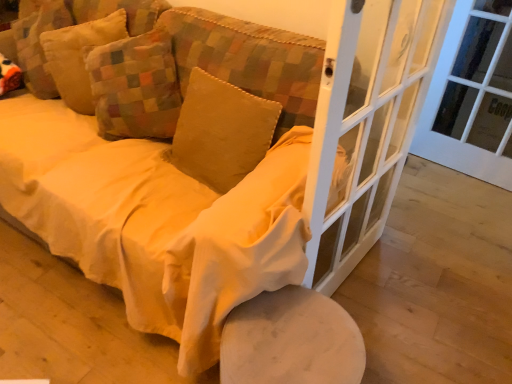
What do you see at coordinates (185, 230) in the screenshot? The image size is (512, 384). I see `velvet yellow couch at center` at bounding box center [185, 230].

What is the approximate height of velvet yellow couch at center?

91.75 centimeters.

The height and width of the screenshot is (384, 512). I want to click on white glass screen door at center right, so click(367, 122).

Identify the location of velvet yellow pillow at upper left, the 3th pillow in the right-to-left sequence. The height and width of the screenshot is (384, 512). (79, 56).

Based on their sizes in the image, would you say white glass screen door at center right is bigger or smaller than velvet yellow pillow at upper left, which ranks as the second pillow in right-to-left order?

Clearly, white glass screen door at center right is larger in size than velvet yellow pillow at upper left, which ranks as the second pillow in right-to-left order.

Does white glass screen door at center right appear on the left side of velvet yellow pillow at upper left, acting as the second pillow starting from the left?

In fact, white glass screen door at center right is to the right of velvet yellow pillow at upper left, acting as the second pillow starting from the left.

From a real-world perspective, between white glass screen door at center right and velvet yellow pillow at upper left, which ranks as the second pillow in right-to-left order, who is vertically lower?

white glass screen door at center right, from a real-world perspective.

Locate an element on the screen. screen door in front of the velvet yellow pillow at upper left, acting as the second pillow starting from the left is located at coordinates tap(367, 122).

Is velvet yellow couch at center beside velvet yellow pillow at upper left, the 1th pillow from the left?

velvet yellow couch at center is not next to velvet yellow pillow at upper left, the 1th pillow from the left, and they're not touching.

Based on the photo, from a real-world perspective, between velvet yellow couch at center and velvet yellow pillow at upper left, the 3th pillow in the right-to-left sequence, who is vertically lower?

velvet yellow couch at center is physically lower.

Does velvet yellow couch at center have a larger size compared to velvet yellow pillow at upper left, the 1th pillow from the left?

Indeed, velvet yellow couch at center has a larger size compared to velvet yellow pillow at upper left, the 1th pillow from the left.

Does velvet yellow couch at center have a lesser width compared to velvet yellow pillow at upper left, the 1th pillow from the left?

No.

Is point (313, 156) less distant than point (96, 30)?

Yes, it is.

From the image's perspective, is white glass screen door at center right under velvet yellow pillow at upper left, the 1th pillow from the left?

Correct, white glass screen door at center right appears lower than velvet yellow pillow at upper left, the 1th pillow from the left, in the image.

Which object is more forward, white glass screen door at center right or velvet yellow pillow at upper left, the 1th pillow from the left?

white glass screen door at center right is more forward.

From a real-world perspective, between white glass screen door at center right and velvet yellow pillow at upper left, the 3th pillow in the right-to-left sequence, who is vertically lower?

In real-world perspective, white glass screen door at center right is lower.

From the image's perspective, is velvet yellow pillow at upper left, the 1th pillow from the left, above white marble stool at lower center?

→ Correct, velvet yellow pillow at upper left, the 1th pillow from the left, appears higher than white marble stool at lower center in the image.

Considering the sizes of objects velvet yellow pillow at upper left, the 3th pillow in the right-to-left sequence, and white marble stool at lower center in the image provided, who is wider, velvet yellow pillow at upper left, the 3th pillow in the right-to-left sequence, or white marble stool at lower center?

white marble stool at lower center.

Based on their positions, is velvet yellow pillow at upper left, the 1th pillow from the left, located to the left or right of white marble stool at lower center?

velvet yellow pillow at upper left, the 1th pillow from the left, is positioned on white marble stool at lower center's left side.

Could you tell me if velvet yellow pillow at upper left, the 1th pillow from the left, is facing white marble stool at lower center?

No, velvet yellow pillow at upper left, the 1th pillow from the left, does not turn towards white marble stool at lower center.

I want to click on studio couch in front of the velvet yellow pillow at center, acting as the third pillow starting from the left, so click(x=185, y=230).

Does velvet yellow pillow at center, which is the first pillow in right-to-left order, come in front of velvet yellow couch at center?

No, it is not.

Choose the correct answer: Is velvet yellow pillow at center, which is the first pillow in right-to-left order, inside velvet yellow couch at center or outside it?

The correct answer is: inside.

What's the angular difference between velvet yellow pillow at center, acting as the third pillow starting from the left, and velvet yellow couch at center's facing directions?

There is a 0.000449-degree angle between the facing directions of velvet yellow pillow at center, acting as the third pillow starting from the left, and velvet yellow couch at center.

Which is behind, point (231, 331) or point (369, 83)?

The point (369, 83) is farther from the camera.

Is white marble stool at lower center positioned in front of white glass screen door at center right?

No, white marble stool at lower center is behind white glass screen door at center right.

From a real-world perspective, between white marble stool at lower center and white glass screen door at center right, who is vertically higher?

white glass screen door at center right.

From the image's perspective, is white glass screen door at center right below velvet yellow pillow at center, acting as the third pillow starting from the left?

Yes.

Is white glass screen door at center right looking in the opposite direction of velvet yellow pillow at center, which is the first pillow in right-to-left order?

Yes.

Which of these two, white glass screen door at center right or velvet yellow pillow at center, which is the first pillow in right-to-left order, stands shorter?

velvet yellow pillow at center, which is the first pillow in right-to-left order.

Based on the photo, between white glass screen door at center right and velvet yellow pillow at center, which is the first pillow in right-to-left order, which one has smaller width?

With smaller width is white glass screen door at center right.

The image size is (512, 384). There is a white glass screen door at center right. Find the location of `the 2nd pillow above it (from the image's perspective)`. the 2nd pillow above it (from the image's perspective) is located at coordinates [x=135, y=87].

Where is `studio couch that is in front of the velvet yellow pillow at upper left, the 1th pillow from the left`? studio couch that is in front of the velvet yellow pillow at upper left, the 1th pillow from the left is located at coordinates (185, 230).

Which object lies further to the anchor point white glass door at right, velvet yellow pillow at upper left, the 3th pillow in the right-to-left sequence, or velvet yellow couch at center?

Based on the image, velvet yellow pillow at upper left, the 3th pillow in the right-to-left sequence, appears to be further to white glass door at right.

When comparing their distances from velvet yellow pillow at upper left, the 3th pillow in the right-to-left sequence, does velvet yellow pillow at upper left, acting as the second pillow starting from the left, or white marble stool at lower center seem further?

white marble stool at lower center lies further to velvet yellow pillow at upper left, the 3th pillow in the right-to-left sequence, than the other object.

Based on their spatial positions, is velvet yellow couch at center or velvet yellow pillow at center, acting as the third pillow starting from the left, closer to velvet yellow pillow at upper left, acting as the second pillow starting from the left?

Based on the image, velvet yellow pillow at center, acting as the third pillow starting from the left, appears to be nearer to velvet yellow pillow at upper left, acting as the second pillow starting from the left.

When comparing their distances from velvet yellow pillow at center, which is the first pillow in right-to-left order, does velvet yellow pillow at upper left, which ranks as the second pillow in right-to-left order, or white glass screen door at center right seem closer?

velvet yellow pillow at upper left, which ranks as the second pillow in right-to-left order, is closer to velvet yellow pillow at center, which is the first pillow in right-to-left order.

Estimate the real-world distances between objects in this image. Which object is closer to white glass door at right, velvet yellow pillow at upper left, the 3th pillow in the right-to-left sequence, or white marble stool at lower center?

The object closer to white glass door at right is white marble stool at lower center.

Based on their spatial positions, is velvet yellow pillow at center, which is the first pillow in right-to-left order, or velvet yellow pillow at upper left, which ranks as the second pillow in right-to-left order, further from white glass door at right?

Based on the image, velvet yellow pillow at upper left, which ranks as the second pillow in right-to-left order, appears to be further to white glass door at right.

Looking at the image, which one is located closer to velvet yellow couch at center, velvet yellow pillow at upper left, the 1th pillow from the left, or velvet yellow pillow at center, which is the first pillow in right-to-left order?

Based on the image, velvet yellow pillow at center, which is the first pillow in right-to-left order, appears to be nearer to velvet yellow couch at center.

Based on their spatial positions, is velvet yellow couch at center or velvet yellow pillow at upper left, the 1th pillow from the left, further from velvet yellow pillow at upper left, which ranks as the second pillow in right-to-left order?

velvet yellow couch at center lies further to velvet yellow pillow at upper left, which ranks as the second pillow in right-to-left order, than the other object.

You are a GUI agent. You are given a task and a screenshot of the screen. Output one action in this format:
    pyautogui.click(x=<x>, y=<y>)
    Task: Click on the pillow between velvet yellow pillow at upper left, which ranks as the second pillow in right-to-left order, and white marble stool at lower center in the up-down direction
    The height and width of the screenshot is (384, 512).
    Given the screenshot: What is the action you would take?
    pyautogui.click(x=221, y=131)

This screenshot has width=512, height=384. In order to click on screen door between velvet yellow couch at center and white glass door at right in the horizontal direction in this screenshot , I will do `click(367, 122)`.

Identify the location of studio couch between velvet yellow pillow at upper left, the 3th pillow in the right-to-left sequence, and white glass screen door at center right from left to right. (185, 230).

At what (x,y) coordinates should I click in order to perform the action: click on pillow between velvet yellow pillow at upper left, which ranks as the second pillow in right-to-left order, and white glass screen door at center right from left to right. Please return your answer as a coordinate pair (x, y). Looking at the image, I should click on (221, 131).